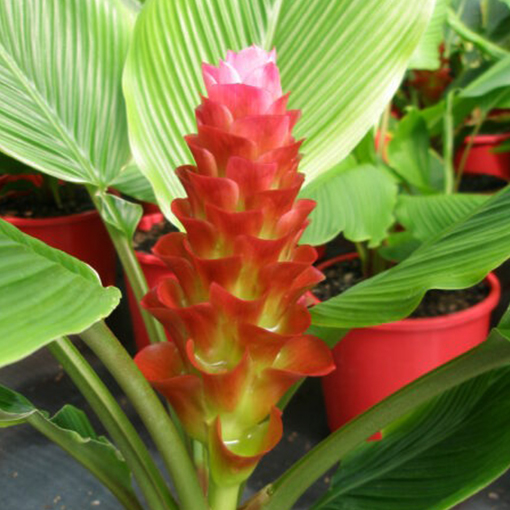
Identify the location of 6 flower pots. (431, 350), (69, 222), (492, 151), (142, 212), (388, 132), (431, 69).